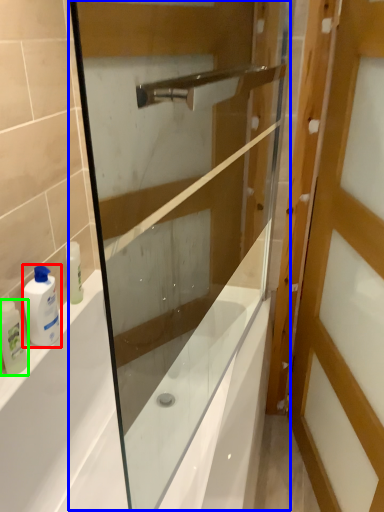
Question: Considering the real-world distances, which object is closest to toiletry (highlighted by a red box)? screen door (highlighted by a blue box) or toiletry (highlighted by a green box).

Choices:
 (A) screen door
 (B) toiletry

Answer: (B)